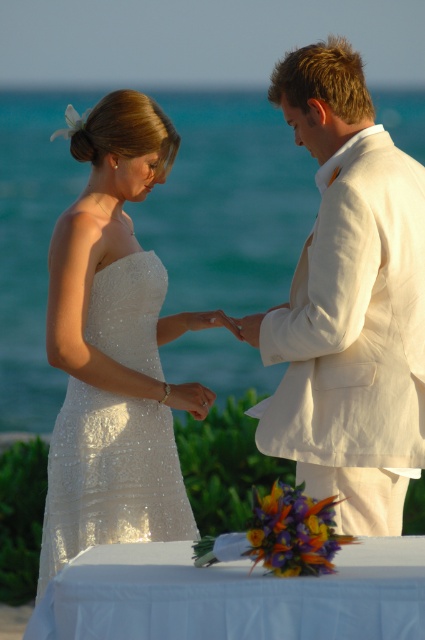
You are a photographer at the wedding. You want to ensure both the white linen suit at center and the white sequined dress at left are fully visible in the photo. Which one requires more space in the frame to capture its full width?

The white sequined dress at left requires more space in the frame because it has a greater width compared to the white linen suit at center.

Based on the scene described, which object is bigger in size between the white sequined dress at left and the silver metallic ring at center?

The white sequined dress at left is larger in size compared to the silver metallic ring at center.